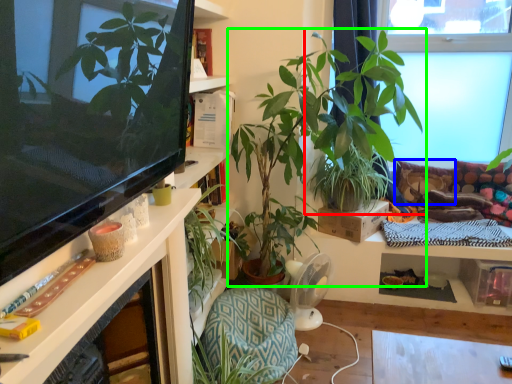
Question: Which object is the closest to the houseplant (highlighted by a red box)? Choose among these: pillow (highlighted by a blue box) or houseplant (highlighted by a green box).

Choices:
 (A) pillow
 (B) houseplant

Answer: (B)